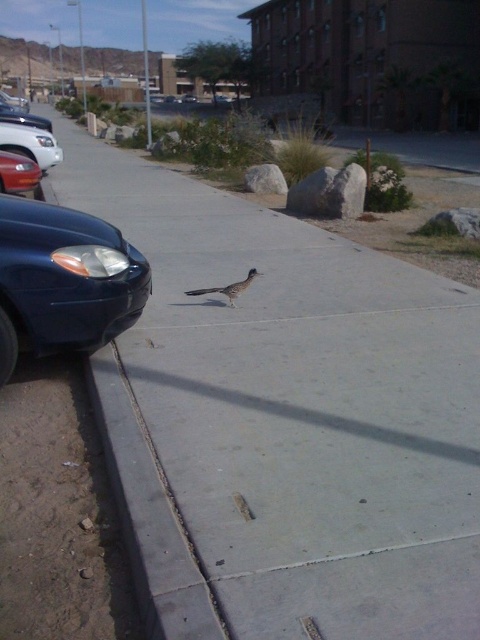
Question: Does matte black sedan at left have a greater width compared to shiny silver sedan at left?

Choices:
 (A) no
 (B) yes

Answer: (A)

Question: Among these points, which one is nearest to the camera?

Choices:
 (A) (48, 122)
 (B) (237, 288)
 (C) (24, 179)

Answer: (B)

Question: Which object is farther from the camera taking this photo?

Choices:
 (A) gray concrete curb at lower left
 (B) brown feathered bird at center
 (C) glossy blue sedan at left
 (D) shiny silver sedan at left

Answer: (D)

Question: Is matte black sedan at left below shiny silver sedan at left?

Choices:
 (A) yes
 (B) no

Answer: (A)

Question: Is gray concrete curb at lower left behind shiny silver sedan at left?

Choices:
 (A) yes
 (B) no

Answer: (B)

Question: Which point is closer to the camera?

Choices:
 (A) (117, 440)
 (B) (1, 113)

Answer: (A)